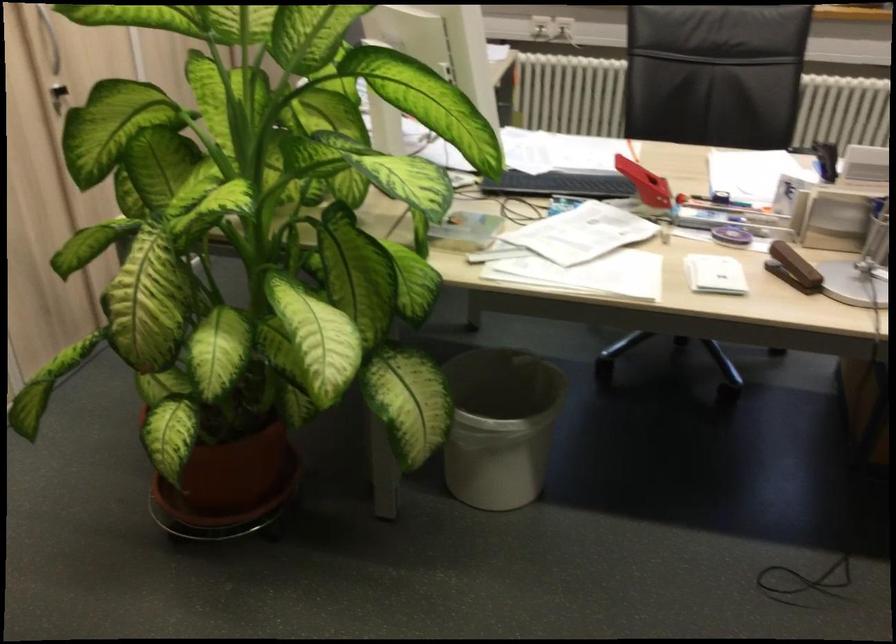
Locate an element on the screen. The height and width of the screenshot is (644, 896). brown stapler is located at coordinates (793, 268).